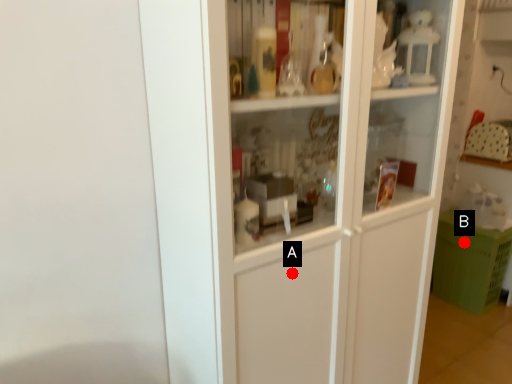
Question: Two points are circled on the image, labeled by A and B beside each circle. Which of the following is the closest to the observer?

Choices:
 (A) A is closer
 (B) B is closer

Answer: (A)